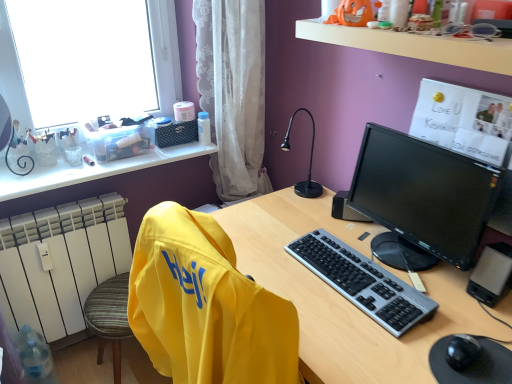
Identify the location of vacant region to the left of black plastic computer tower at lower right. 438,288.